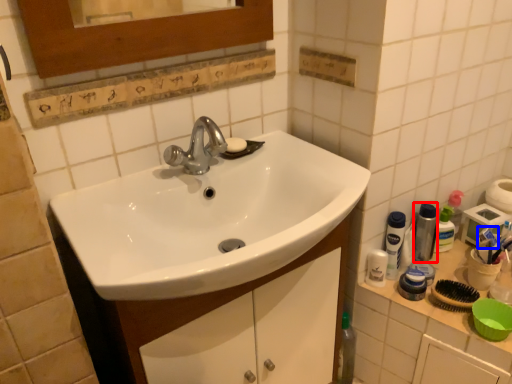
Question: Which object is closer to the camera taking this photo, mouthwash (highlighted by a red box) or toothpaste (highlighted by a blue box)?

Choices:
 (A) mouthwash
 (B) toothpaste

Answer: (A)